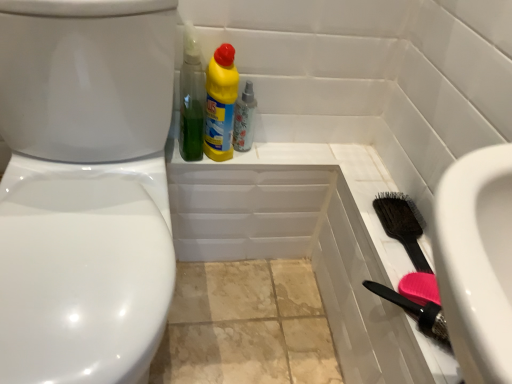
I want to click on free space to the back side of black bristle brush at right, so click(368, 173).